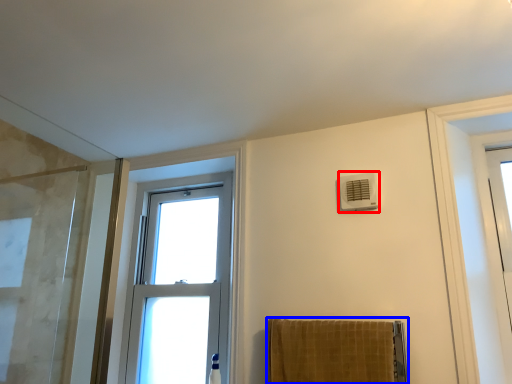
Question: Which point is closer to the camera, air conditioning (highlighted by a red box) or towel (highlighted by a blue box)?

Choices:
 (A) air conditioning
 (B) towel

Answer: (B)